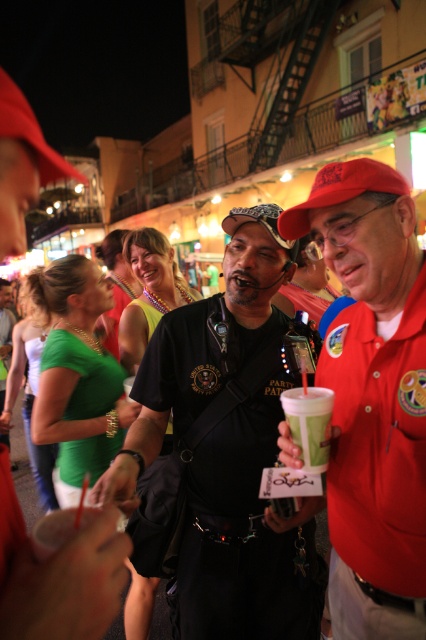
Question: Considering the real-world distances, which object is closest to the red matte baseball cap at center?

Choices:
 (A) black matte shirt at center
 (B) green paper cup at center

Answer: (B)

Question: Where is black matte shirt at center located in relation to red matte baseball cap at center in the image?

Choices:
 (A) above
 (B) below

Answer: (B)

Question: Does black matte shirt at center come behind matte red cap at center?

Choices:
 (A) no
 (B) yes

Answer: (B)

Question: Is black matte shirt at center smaller than green paper cup at center?

Choices:
 (A) yes
 (B) no

Answer: (B)

Question: Among these objects, which one is farthest from the camera?

Choices:
 (A) matte red cap at center
 (B) red matte baseball cap at center
 (C) black matte shirt at center

Answer: (B)

Question: Which point appears closest to the camera in this image?

Choices:
 (A) (420, 593)
 (B) (339, 180)
 (C) (131, 429)
 (D) (301, 440)

Answer: (A)